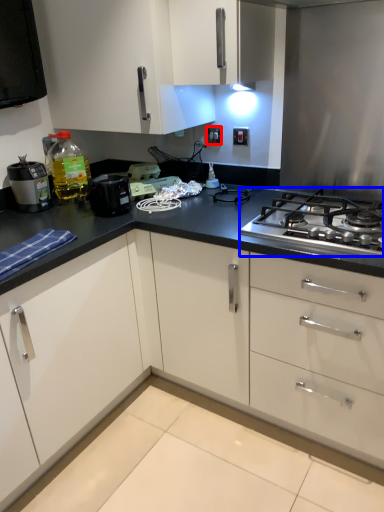
Question: Which object appears closest to the camera in this image, electric outlet (highlighted by a red box) or gas stove (highlighted by a blue box)?

Choices:
 (A) electric outlet
 (B) gas stove

Answer: (B)